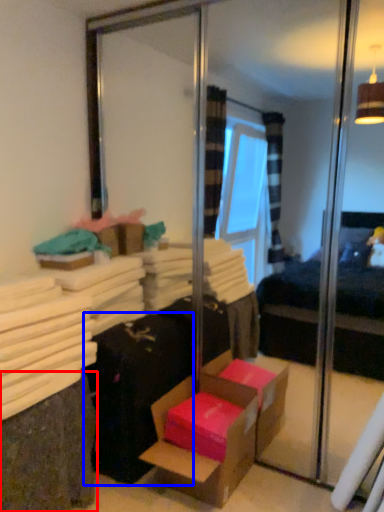
Question: Which point is closer to the camera, shelf (highlighted by a red box) or luggage (highlighted by a blue box)?

Choices:
 (A) shelf
 (B) luggage

Answer: (A)